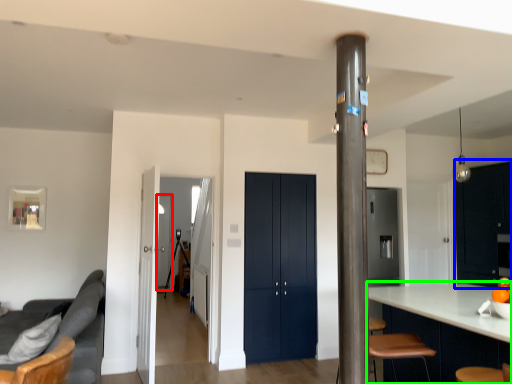
Question: Which object is positioned farthest from glass door (highlighted by a red box)? Select from dresser (highlighted by a blue box) and cabinetry (highlighted by a green box).

Choices:
 (A) dresser
 (B) cabinetry

Answer: (B)